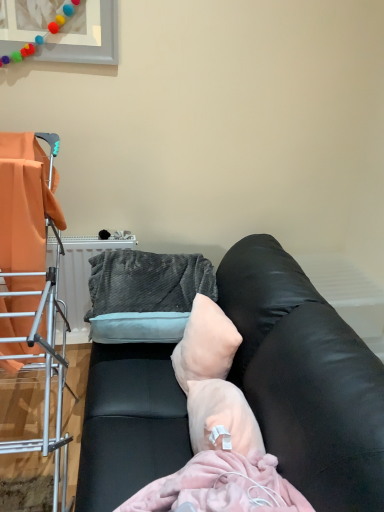
Question: From the image's perspective, is metal drying rack at left beneath velvety gray bean bag chair at center?

Choices:
 (A) yes
 (B) no

Answer: (A)

Question: Is the depth of metal drying rack at left less than that of velvety gray bean bag chair at center?

Choices:
 (A) no
 (B) yes

Answer: (B)

Question: From the image's perspective, is metal drying rack at left over velvety gray bean bag chair at center?

Choices:
 (A) no
 (B) yes

Answer: (A)

Question: Is velvety gray bean bag chair at center a part of metal drying rack at left?

Choices:
 (A) no
 (B) yes

Answer: (A)

Question: Is metal drying rack at left not within velvety gray bean bag chair at center?

Choices:
 (A) no
 (B) yes

Answer: (B)

Question: In the image, is metal drying rack at left positioned in front of or behind pale pink fabric pillow at center?

Choices:
 (A) behind
 (B) front

Answer: (B)

Question: In terms of size, does metal drying rack at left appear bigger or smaller than pale pink fabric pillow at center?

Choices:
 (A) small
 (B) big

Answer: (B)

Question: Would you say metal drying rack at left is to the left or to the right of pale pink fabric pillow at center in the picture?

Choices:
 (A) right
 (B) left

Answer: (B)

Question: Does point (66, 464) appear closer or farther from the camera than point (230, 339)?

Choices:
 (A) closer
 (B) farther

Answer: (A)

Question: In terms of width, does black leather couch at center look wider or thinner when compared to velvety gray bean bag chair at center?

Choices:
 (A) wide
 (B) thin

Answer: (A)

Question: From the image's perspective, is black leather couch at center located above or below velvety gray bean bag chair at center?

Choices:
 (A) below
 (B) above

Answer: (A)

Question: Is black leather couch at center taller or shorter than velvety gray bean bag chair at center?

Choices:
 (A) tall
 (B) short

Answer: (A)

Question: Based on their sizes in the image, would you say black leather couch at center is bigger or smaller than velvety gray bean bag chair at center?

Choices:
 (A) small
 (B) big

Answer: (B)

Question: In the image, is pale pink fabric pillow at center positioned in front of or behind metal drying rack at left?

Choices:
 (A) behind
 (B) front

Answer: (A)

Question: Would you say pale pink fabric pillow at center is inside or outside metal drying rack at left?

Choices:
 (A) outside
 (B) inside

Answer: (A)